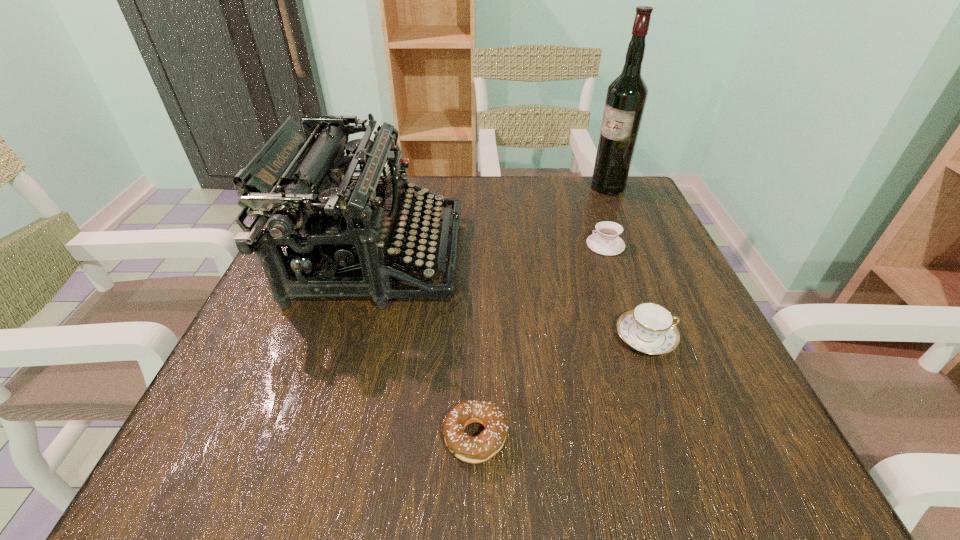
Identify the location of object at the far left corner. The image size is (960, 540). (300, 180).

Where is `object situated at the far right corner`? This screenshot has height=540, width=960. object situated at the far right corner is located at coordinates (626, 97).

In the image, there is a desktop. Identify the location of vacant space at the far edge. (569, 222).

You are a GUI agent. You are given a task and a screenshot of the screen. Output one action in this format:
    pyautogui.click(x=<x>, y=<y>)
    Task: Click on the vacant space at the near edge of the desktop
    
    Given the screenshot: What is the action you would take?
    pyautogui.click(x=567, y=448)

This screenshot has width=960, height=540. I want to click on blank area at the left edge, so click(x=265, y=410).

Where is `vacant space at the right edge of the desktop`? vacant space at the right edge of the desktop is located at coordinates (732, 407).

The image size is (960, 540). In the image, there is a desktop. Find the location of `blank space at the far right corner`. blank space at the far right corner is located at coordinates (583, 218).

Find the location of a particular element. vacant point at the near right corner is located at coordinates (739, 421).

Identify the location of free space between the farthest object and the second tallest object. (492, 222).

The width and height of the screenshot is (960, 540). I want to click on free space that is in between the second tallest object and the shorter teacup, so click(x=492, y=251).